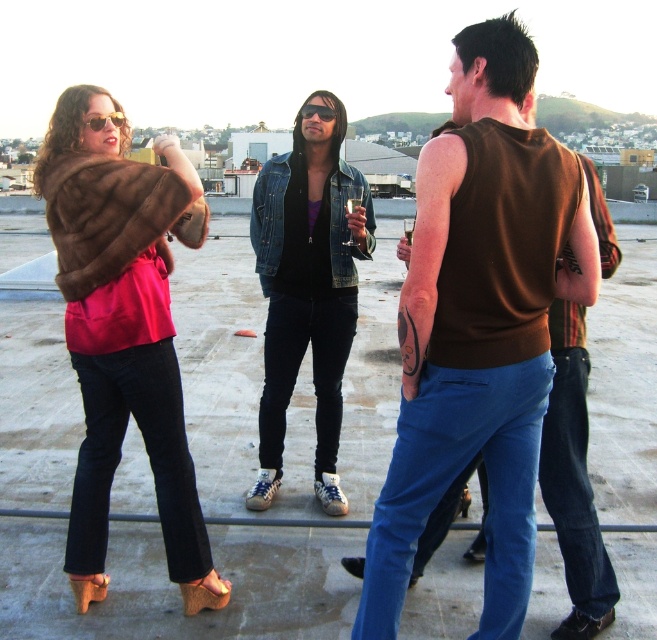
You are a fashion designer observing the rooftop gathering. You need to decide which item to feature in your upcoming collection. Which item is bigger in size between the brown fur coat at left and the matte brown sunglasses at upper left?

The brown fur coat at left is larger in size compared to the matte brown sunglasses at upper left, so it would be the better choice for featuring in the collection.

You are standing at the point labeled point [319,108] and want to walk to the point labeled point [110,172]. Which direction should you move to reach your destination?

You should move forward to reach point [110,172] because it is in front of point [319,108].